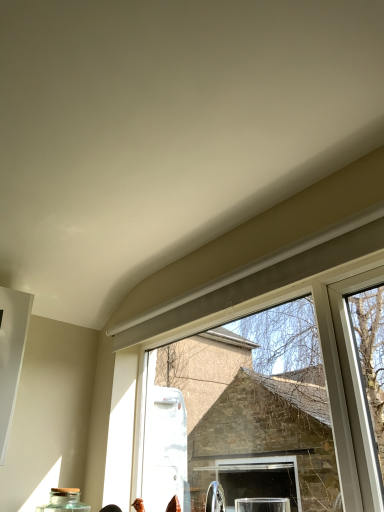
This screenshot has height=512, width=384. Find the location of `clear glass window at center`. clear glass window at center is located at coordinates (191, 334).

Describe the element at coordinates (191, 334) in the screenshot. I see `clear glass window at center` at that location.

You are a GUI agent. You are given a task and a screenshot of the screen. Output one action in this format:
    pyautogui.click(x=<x>, y=<y>)
    Task: Click on the clear glass window at center
    The width and height of the screenshot is (384, 512).
    Given the screenshot: What is the action you would take?
    pyautogui.click(x=191, y=334)